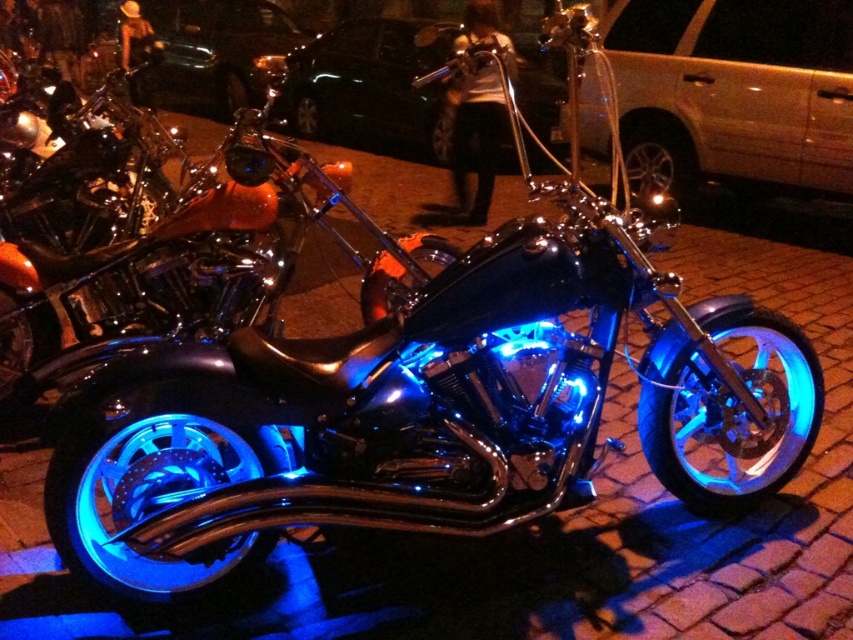
You are a parking attendant who needs to fit both the metallic gold van at center and the glossy black car at upper center into a parking space that is 2.5 meters wide. Based on their sizes, which vehicle should be placed first to ensure both can fit?

The metallic gold van at center is narrower than the glossy black car at upper center, so you should place the metallic gold van at center first to accommodate both vehicles within the 2.5 meter space.

Based on the photo, you are a photographer at a nighttime event and want to capture both the blue illuminated chrome motorcycle at center and the glossy black car at upper center in a single frame. Given their sizes, which object should you position closer to the camera to ensure both are visible clearly?

The blue illuminated chrome motorcycle at center is smaller in size compared to the glossy black car at upper center. To ensure both are visible clearly in a single frame, you should position the glossy black car at upper center closer to the camera since it is larger and needs to be scaled down to match the motorcycle.